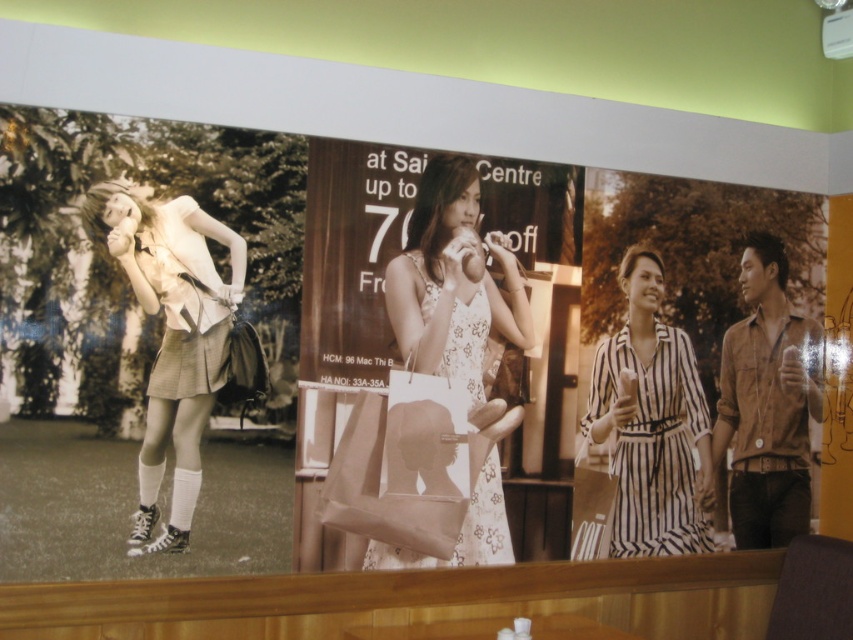
Looking at the advertisement, how does the size of the plaid skirt at left compare to the striped fabric dress at center?

The plaid skirt at left is larger in size than the striped fabric dress at center.